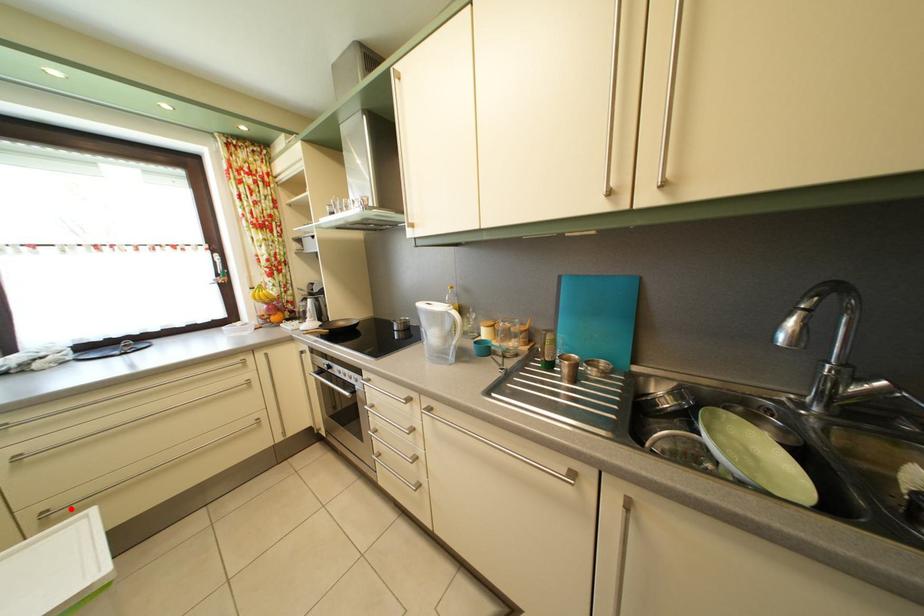
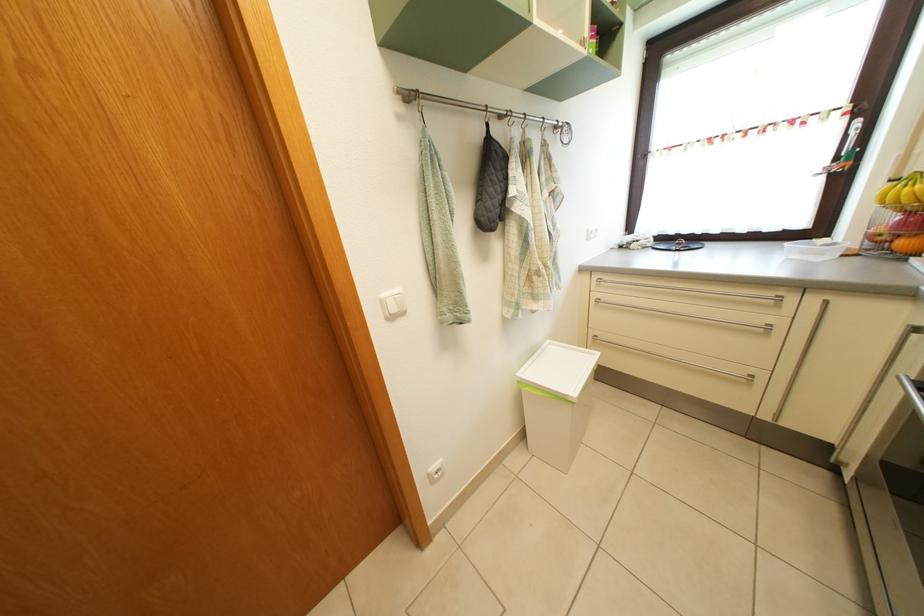
Question: A red point is marked in image1. In image2, is the corresponding 3D point closer to the camera or farther? Reply with the corresponding letter.

Choices:
 (A) The corresponding 3D point is closer.
 (B) The corresponding 3D point is farther.

Answer: (A)